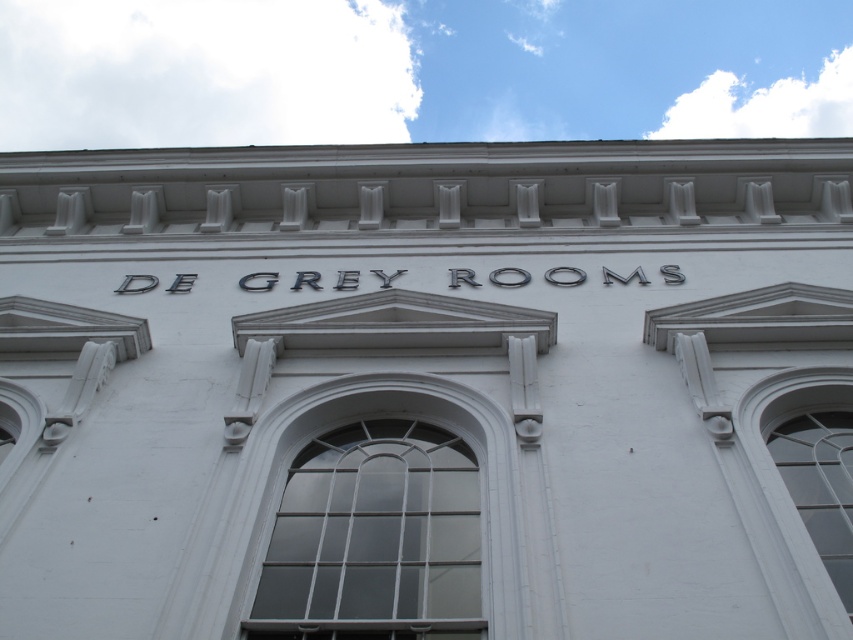
Is clear glass window at center above clear glass window at right?

No, clear glass window at center is not above clear glass window at right.

Which of these two, clear glass window at center or clear glass window at right, stands taller?

Standing taller between the two is clear glass window at right.

Identify the location of clear glass window at center. The width and height of the screenshot is (853, 640). (374, 538).